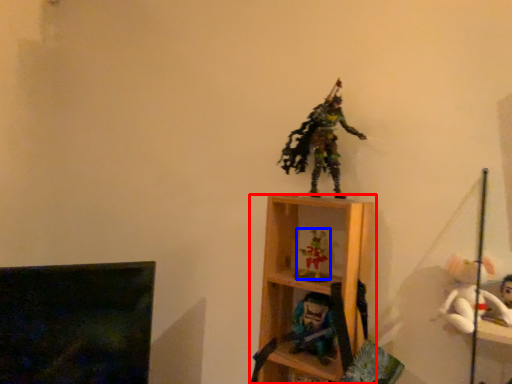
Question: Which of the following is the closest to the observer, shelf (highlighted by a red box) or toy (highlighted by a blue box)?

Choices:
 (A) shelf
 (B) toy

Answer: (A)